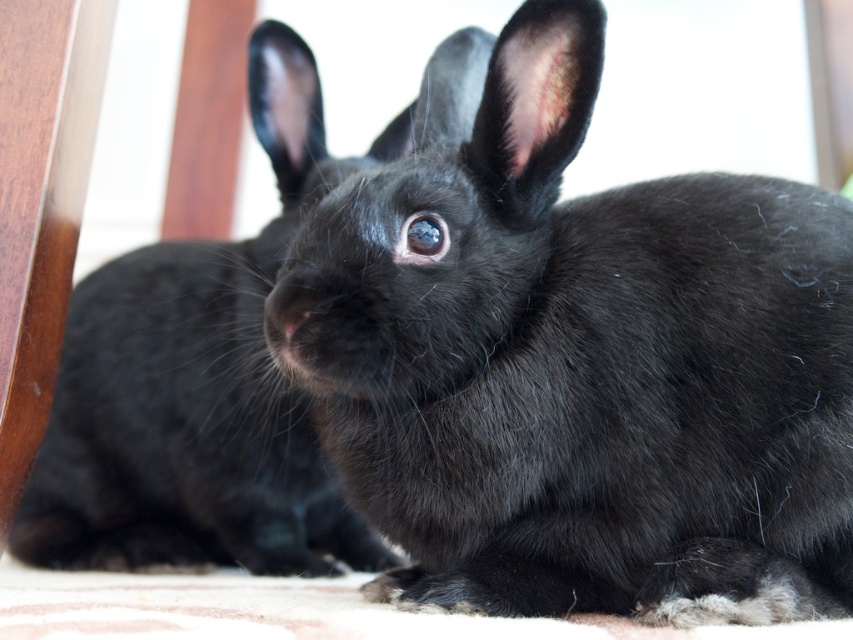
Does black fur rabbit at center have a larger size compared to black furry rabbit at center?

No, black fur rabbit at center is not bigger than black furry rabbit at center.

Is black fur rabbit at center to the left of black furry rabbit at center from the viewer's perspective?

In fact, black fur rabbit at center is to the right of black furry rabbit at center.

Does point (775, 348) come farther from viewer compared to point (149, 401)?

No, (775, 348) is in front of (149, 401).

Locate an element on the screen. The height and width of the screenshot is (640, 853). black fur rabbit at center is located at coordinates (576, 356).